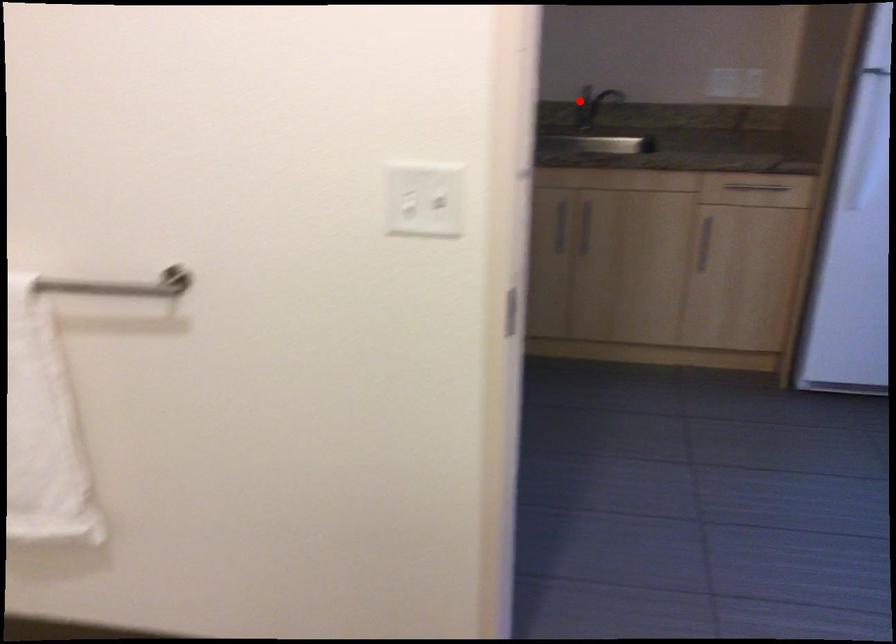
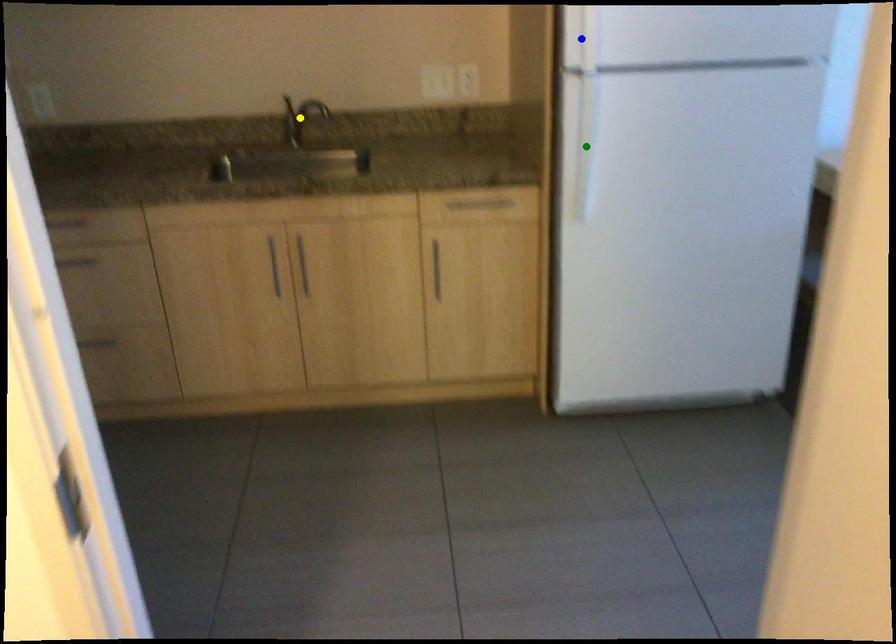
Question: I am providing you with two images of the same scene from different viewpoints. A red point is marked on the first image. You are given multiple points on the second image. Which mark in image 2 goes with the point in image 1?

Choices:
 (A) blue point
 (B) green point
 (C) yellow point

Answer: (C)